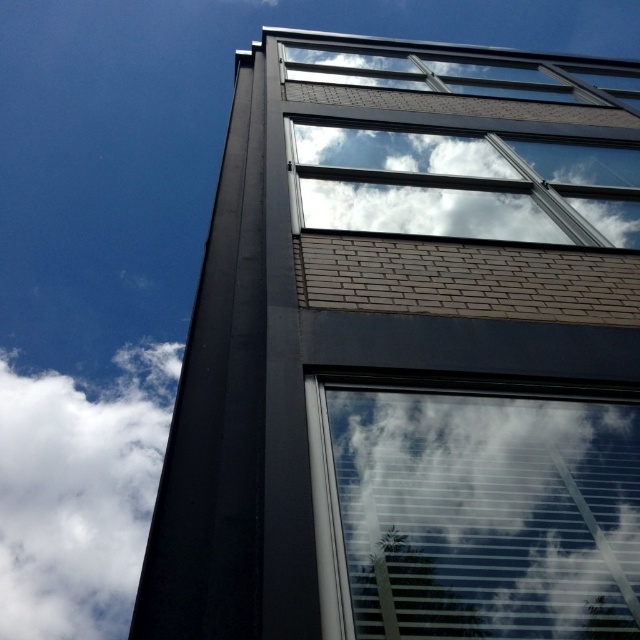
You are standing at the base of the building and looking up. Which object is higher up in the image, the transparent glass window at center or the white cloud at upper center?

The white cloud at upper center is higher up in the image than the transparent glass window at center.